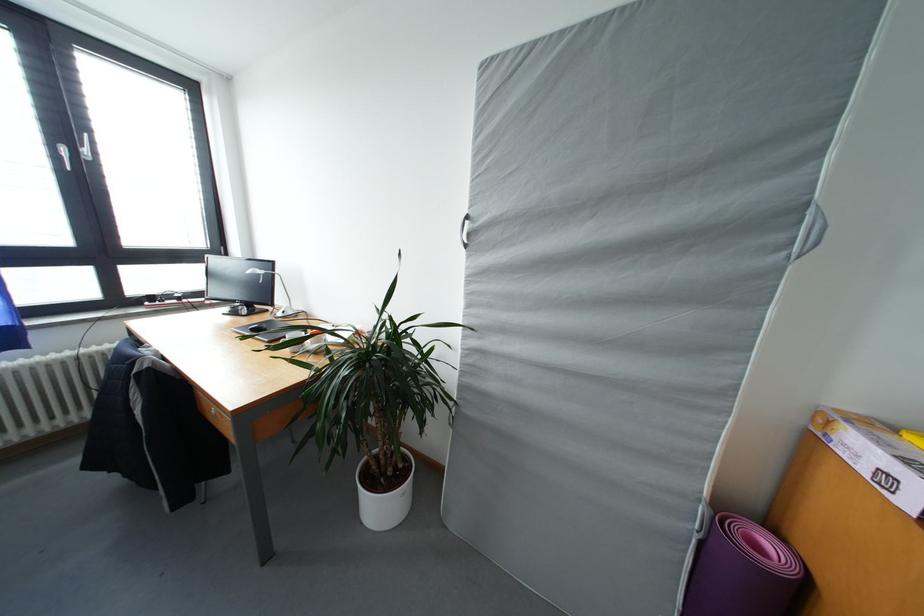
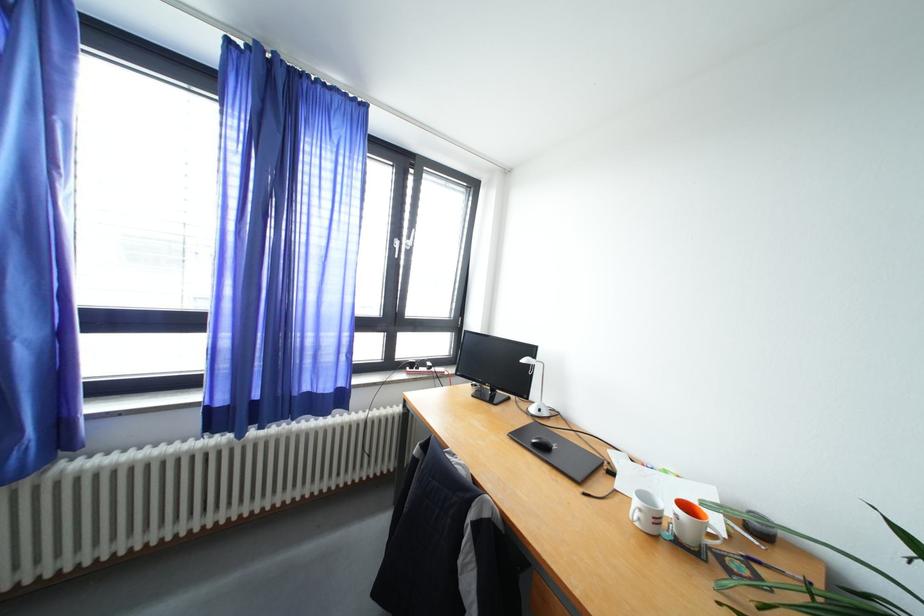
Where in the second image is the point corresponding to the point at 286,318 from the first image?

(540, 415)